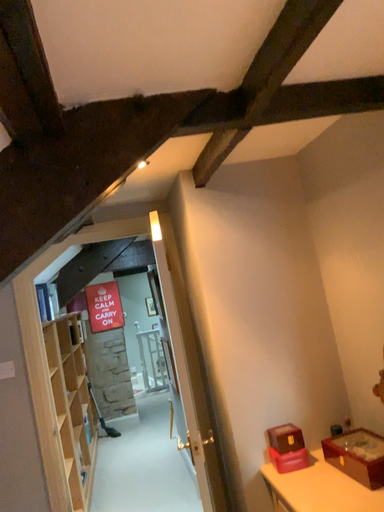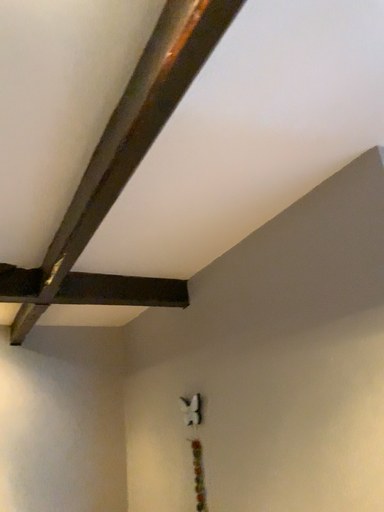
Question: Which way did the camera rotate in the video?

Choices:
 (A) rotated upward
 (B) rotated downward

Answer: (A)